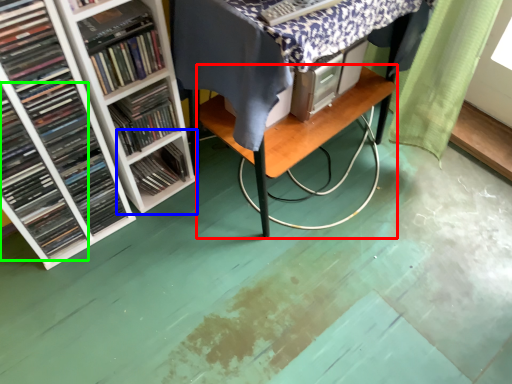
Question: Estimate the real-world distances between objects in this image. Which object is closer to table (highlighted by a red box), shelf (highlighted by a blue box) or book (highlighted by a green box)?

Choices:
 (A) shelf
 (B) book

Answer: (A)